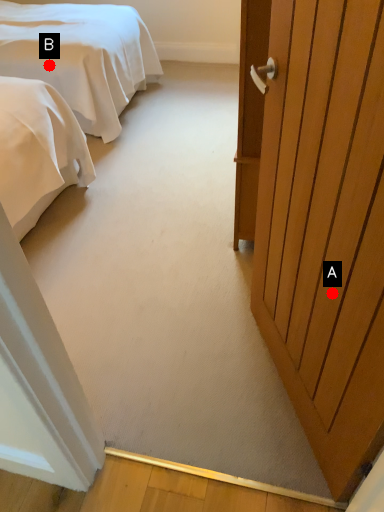
Question: Two points are circled on the image, labeled by A and B beside each circle. Which point is farther to the camera?

Choices:
 (A) A is further
 (B) B is further

Answer: (B)